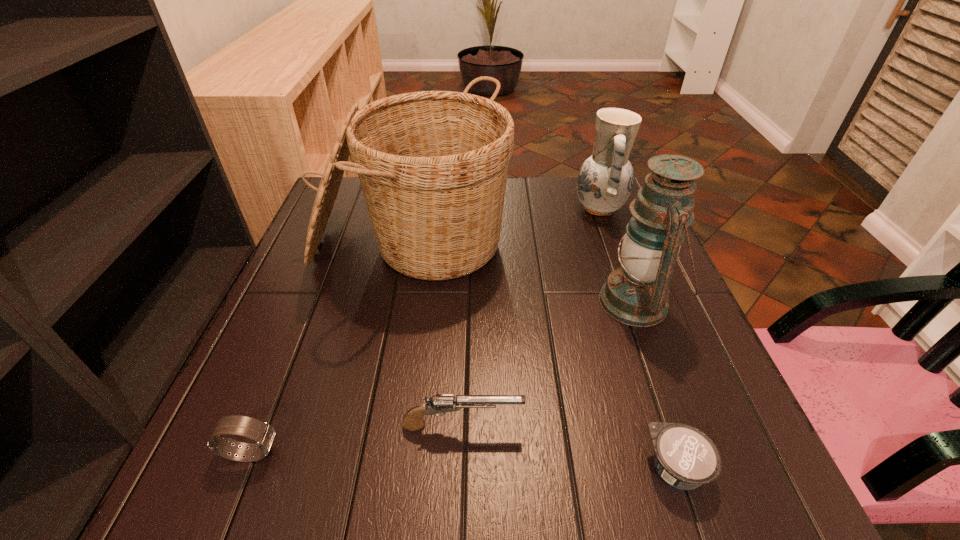
The height and width of the screenshot is (540, 960). I want to click on free point between the watch and the shortest object, so click(465, 461).

Where is `object that is the third nearest to the yogurt`? The height and width of the screenshot is (540, 960). object that is the third nearest to the yogurt is located at coordinates (433, 165).

This screenshot has height=540, width=960. In order to click on object that is the fifth closest one to the oil lamp in this screenshot , I will do `click(263, 434)`.

Find the location of a particular element. The height and width of the screenshot is (540, 960). vacant region that satisfies the following two spatial constraints: 1. on either side of the pottery; 2. on the front side of the yogurt is located at coordinates (693, 468).

The height and width of the screenshot is (540, 960). What are the coordinates of `vacant region that satisfies the following two spatial constraints: 1. on the back side of the shortest object; 2. aiming along the barrel of the fourth farthest object` in the screenshot? It's located at (662, 426).

Image resolution: width=960 pixels, height=540 pixels. Identify the location of free space that satisfies the following two spatial constraints: 1. on either side of the pottery; 2. on the front side of the shortest object. (693, 468).

The height and width of the screenshot is (540, 960). I want to click on free space that satisfies the following two spatial constraints: 1. on either side of the third tallest object; 2. on the front side of the yogurt, so click(693, 468).

Find the location of a particular element. This screenshot has height=540, width=960. vacant space that satisfies the following two spatial constraints: 1. on the face of the shortest object; 2. on the left side of the watch is located at coordinates (246, 468).

In order to click on vacant space that satisfies the following two spatial constraints: 1. on the back side of the yogurt; 2. on the left side of the oil lamp in this screenshot , I will do (x=621, y=302).

Locate an element on the screen. This screenshot has height=540, width=960. free space that satisfies the following two spatial constraints: 1. on the front side of the oil lamp; 2. on the face of the watch is located at coordinates [692, 453].